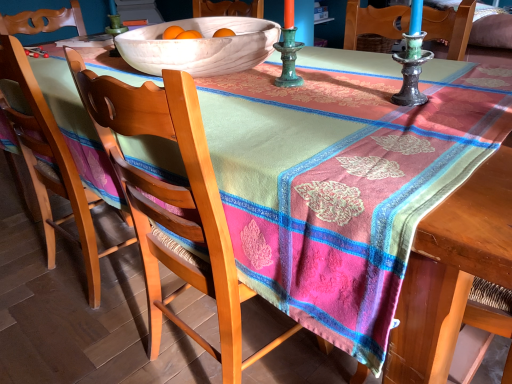
Question: Is wooden chair at center, the 2th chair from the left, looking in the opposite direction of white ceramic bowl at upper center?

Choices:
 (A) yes
 (B) no

Answer: (B)

Question: Is wooden chair at center, acting as the 1th chair starting from the right, positioned beyond the bounds of white ceramic bowl at upper center?

Choices:
 (A) no
 (B) yes

Answer: (B)

Question: Can you confirm if wooden chair at center, the 2th chair from the left, is bigger than white ceramic bowl at upper center?

Choices:
 (A) yes
 (B) no

Answer: (A)

Question: From the image's perspective, would you say wooden chair at center, acting as the 1th chair starting from the right, is positioned over white ceramic bowl at upper center?

Choices:
 (A) yes
 (B) no

Answer: (B)

Question: From the image's perspective, would you say wooden chair at center, acting as the 1th chair starting from the right, is shown under white ceramic bowl at upper center?

Choices:
 (A) no
 (B) yes

Answer: (B)

Question: Is wooden chair at center, acting as the 1th chair starting from the right, facing towards white ceramic bowl at upper center?

Choices:
 (A) no
 (B) yes

Answer: (A)

Question: From a real-world perspective, is white ceramic bowl at upper center located beneath wooden chair at center, the 2th chair from the left?

Choices:
 (A) yes
 (B) no

Answer: (B)

Question: Would you say white ceramic bowl at upper center is a long distance from wooden chair at center, the 2th chair from the left?

Choices:
 (A) yes
 (B) no

Answer: (B)

Question: Considering the relative sizes of white ceramic bowl at upper center and wooden chair at center, the 2th chair from the left, in the image provided, is white ceramic bowl at upper center bigger than wooden chair at center, the 2th chair from the left,?

Choices:
 (A) no
 (B) yes

Answer: (A)

Question: Does white ceramic bowl at upper center come behind wooden chair at center, acting as the 1th chair starting from the right?

Choices:
 (A) no
 (B) yes

Answer: (B)

Question: Can you confirm if white ceramic bowl at upper center is shorter than wooden chair at center, the 2th chair from the left?

Choices:
 (A) yes
 (B) no

Answer: (A)

Question: Could you tell me if white ceramic bowl at upper center is facing wooden chair at center, acting as the 1th chair starting from the right?

Choices:
 (A) no
 (B) yes

Answer: (A)

Question: Can you confirm if wooden chair at center, the 2th chair from the left, is smaller than wooden chair at left, positioned as the 1th chair in left-to-right order?

Choices:
 (A) yes
 (B) no

Answer: (B)